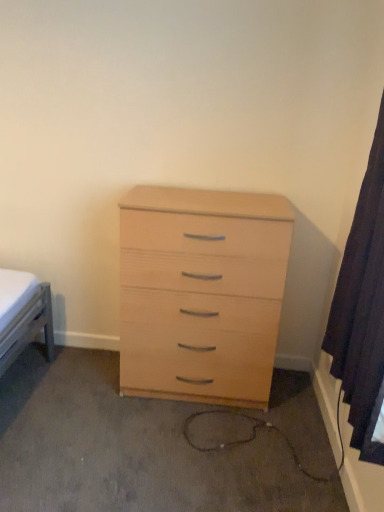
Question: Should I look upward or downward to see dark fabric curtain at right?

Choices:
 (A) up
 (B) down

Answer: (A)

Question: Does light wood chest of drawers at center have a smaller size compared to dark fabric curtain at right?

Choices:
 (A) no
 (B) yes

Answer: (A)

Question: Considering the relative positions of light wood chest of drawers at center and dark fabric curtain at right in the image provided, is light wood chest of drawers at center to the right of dark fabric curtain at right from the viewer's perspective?

Choices:
 (A) no
 (B) yes

Answer: (A)

Question: Does light wood chest of drawers at center have a greater width compared to dark fabric curtain at right?

Choices:
 (A) yes
 (B) no

Answer: (A)

Question: Is light wood chest of drawers at center at the left side of dark fabric curtain at right?

Choices:
 (A) yes
 (B) no

Answer: (A)

Question: Is light wood chest of drawers at center located outside dark fabric curtain at right?

Choices:
 (A) no
 (B) yes

Answer: (B)

Question: Can you confirm if light wood chest of drawers at center is thinner than dark fabric curtain at right?

Choices:
 (A) no
 (B) yes

Answer: (A)

Question: Is dark fabric curtain at right bigger than light wood chest of drawers at center?

Choices:
 (A) yes
 (B) no

Answer: (B)

Question: Is dark fabric curtain at right taller than light wood chest of drawers at center?

Choices:
 (A) no
 (B) yes

Answer: (B)

Question: From the image's perspective, is dark fabric curtain at right located above light wood chest of drawers at center?

Choices:
 (A) no
 (B) yes

Answer: (B)

Question: Considering the relative sizes of dark fabric curtain at right and light wood chest of drawers at center in the image provided, is dark fabric curtain at right shorter than light wood chest of drawers at center?

Choices:
 (A) yes
 (B) no

Answer: (B)

Question: Is dark fabric curtain at right with light wood chest of drawers at center?

Choices:
 (A) yes
 (B) no

Answer: (B)

Question: Does dark fabric curtain at right come behind light wood chest of drawers at center?

Choices:
 (A) yes
 (B) no

Answer: (B)

Question: Considering the positions of point (360, 434) and point (187, 292), is point (360, 434) closer or farther from the camera than point (187, 292)?

Choices:
 (A) farther
 (B) closer

Answer: (B)